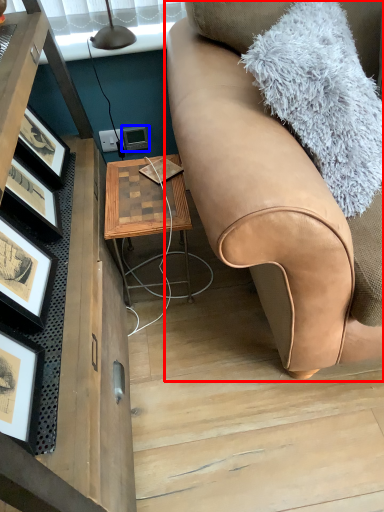
Question: Which object is further to the camera taking this photo, studio couch (highlighted by a red box) or picture frame (highlighted by a blue box)?

Choices:
 (A) studio couch
 (B) picture frame

Answer: (B)